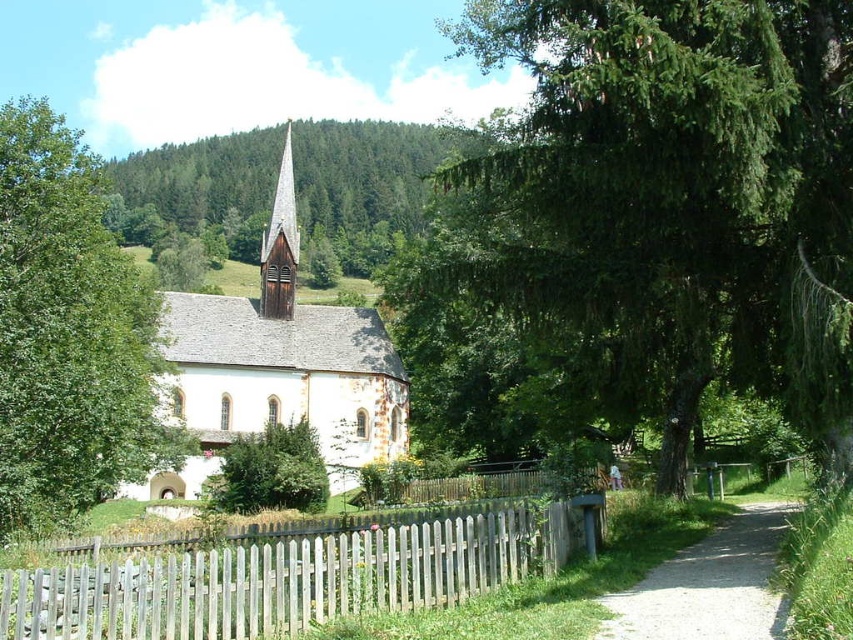
Is white wooden picket fence at lower center positioned before wooden spire at center?

That is True.

Can you confirm if white wooden picket fence at lower center is positioned to the right of wooden spire at center?

→ Indeed, white wooden picket fence at lower center is positioned on the right side of wooden spire at center.

Does point (103, 588) come farther from viewer compared to point (263, 248)?

No, it is not.

Identify the location of white wooden picket fence at lower center. (287, 579).

Is green leafy tree at left shorter than green textured tree at center?

No.

Measure the distance between green leafy tree at left and camera.

green leafy tree at left is 19.80 meters from camera.

Locate an element on the screen. The height and width of the screenshot is (640, 853). green leafy tree at left is located at coordinates (70, 333).

Is green needle-like leaves at center further to the viewer compared to gravel path at lower right?

That is True.

Is green needle-like leaves at center above gravel path at lower right?

Yes, green needle-like leaves at center is above gravel path at lower right.

Is point (549, 221) behind point (621, 592)?

Yes, it is behind point (621, 592).

Identify the location of green needle-like leaves at center. The image size is (853, 640). (643, 224).